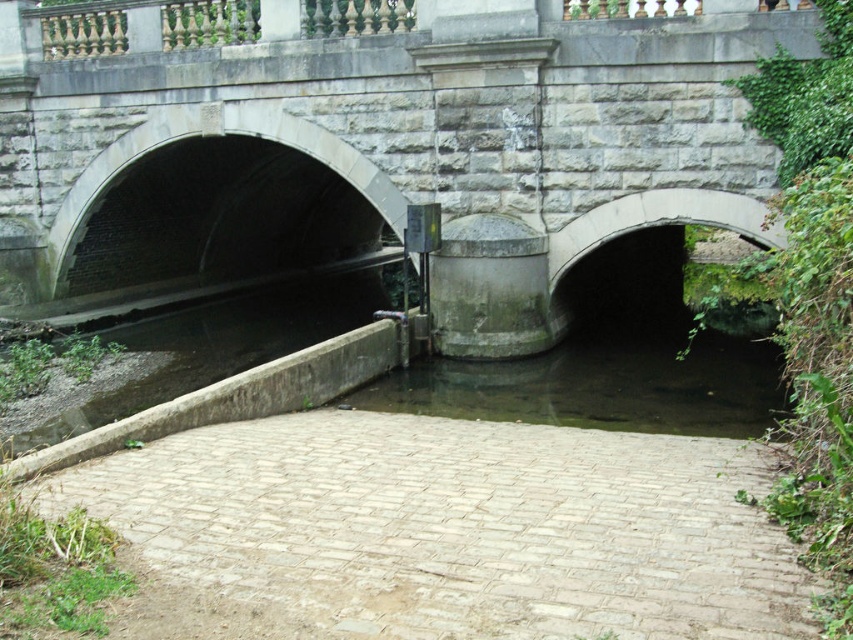
Question: Which of the following is the farthest from the observer?

Choices:
 (A) light beige brick path at center
 (B) clear water at center

Answer: (B)

Question: Can you confirm if clear water at center is positioned to the left of dark gray concrete water at lower left?

Choices:
 (A) no
 (B) yes

Answer: (A)

Question: Which point is farther from the camera taking this photo?

Choices:
 (A) (50, 422)
 (B) (149, 156)
 (C) (547, 372)
 (D) (282, 544)

Answer: (B)

Question: Can you confirm if stone bridge at center is wider than light beige brick path at center?

Choices:
 (A) yes
 (B) no

Answer: (A)

Question: Which object appears farthest from the camera in this image?

Choices:
 (A) stone bridge at center
 (B) dark gray concrete water at lower left
 (C) light beige brick path at center

Answer: (A)

Question: Is stone bridge at center thinner than clear water at center?

Choices:
 (A) yes
 (B) no

Answer: (B)